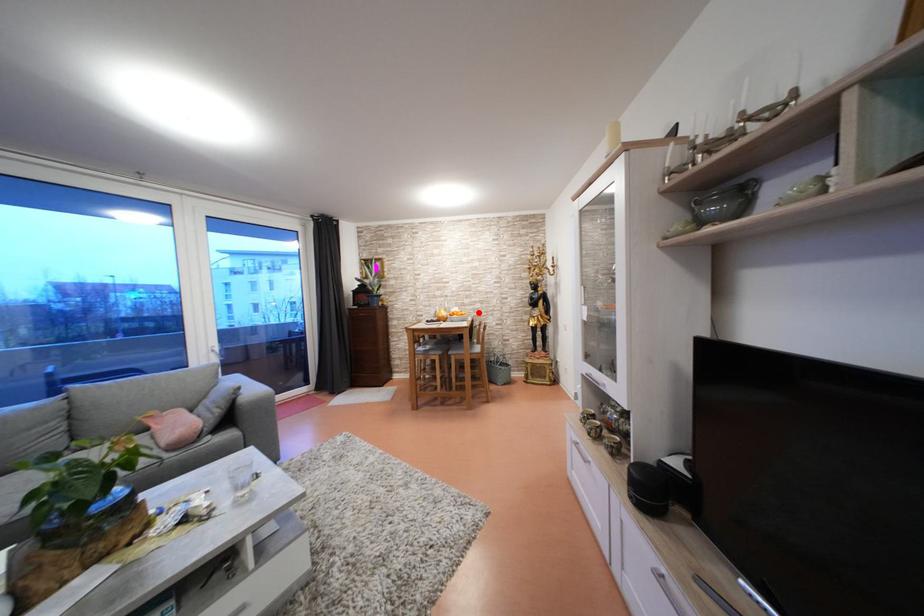
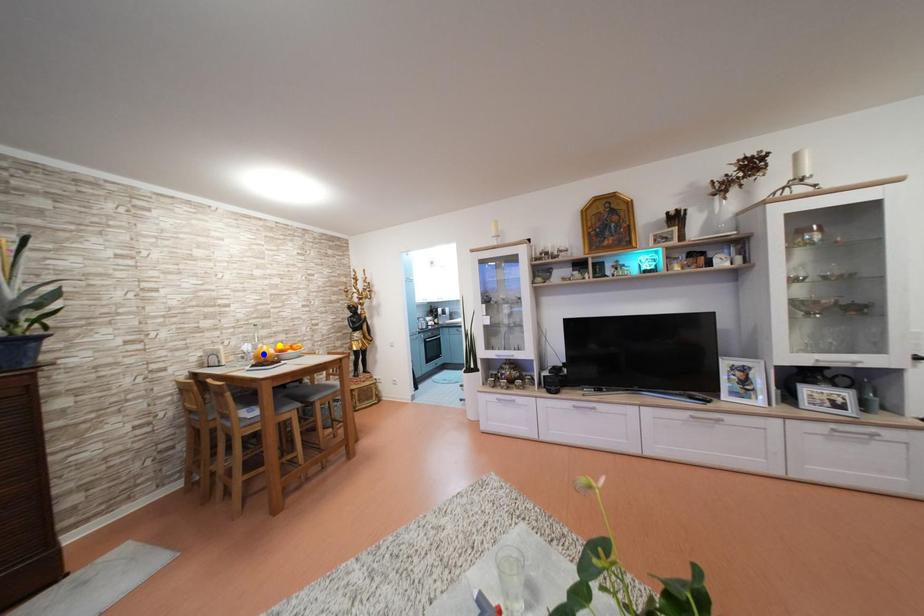
Question: I am providing you with two images of the same scene from different viewpoints. A red point is marked on the first image. You are given multiple points on the second image. Which mark in image 2 goes with the point in image 1?

Choices:
 (A) yellow point
 (B) green point
 (C) blue point

Answer: (A)